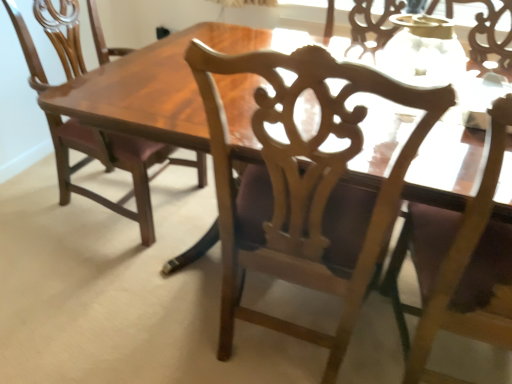
Question: From their relative heights in the image, would you say matte wood chair at left, which appears as the first chair when viewed from the left, is taller or shorter than light wood chair at upper right, marked as the third chair in a left-to-right arrangement?

Choices:
 (A) tall
 (B) short

Answer: (B)

Question: Based on their sizes in the image, would you say matte wood chair at left, which appears as the first chair when viewed from the left, is bigger or smaller than light wood chair at upper right, which ranks as the first chair in right-to-left order?

Choices:
 (A) small
 (B) big

Answer: (B)

Question: Which object is the closest to the matte wood chair at left, which appears as the first chair when viewed from the left?

Choices:
 (A) wooden carved chair at center, which ranks as the 2th chair in left-to-right order
 (B) light wood chair at upper right, marked as the third chair in a left-to-right arrangement

Answer: (A)

Question: Which object is positioned farthest from the matte wood chair at left, acting as the third chair starting from the right?

Choices:
 (A) light wood chair at upper right, which ranks as the first chair in right-to-left order
 (B) wooden carved chair at center, which ranks as the 2th chair in right-to-left order

Answer: (A)